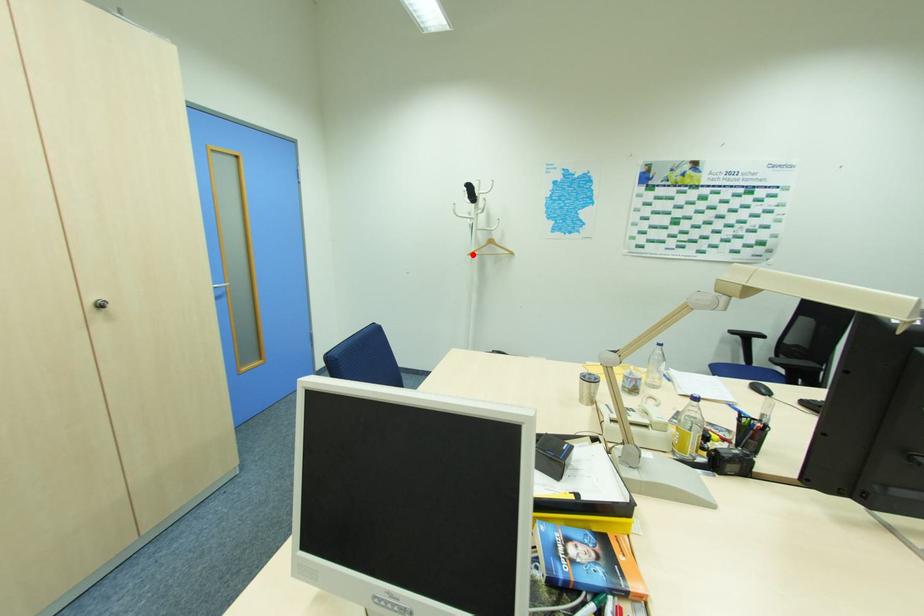
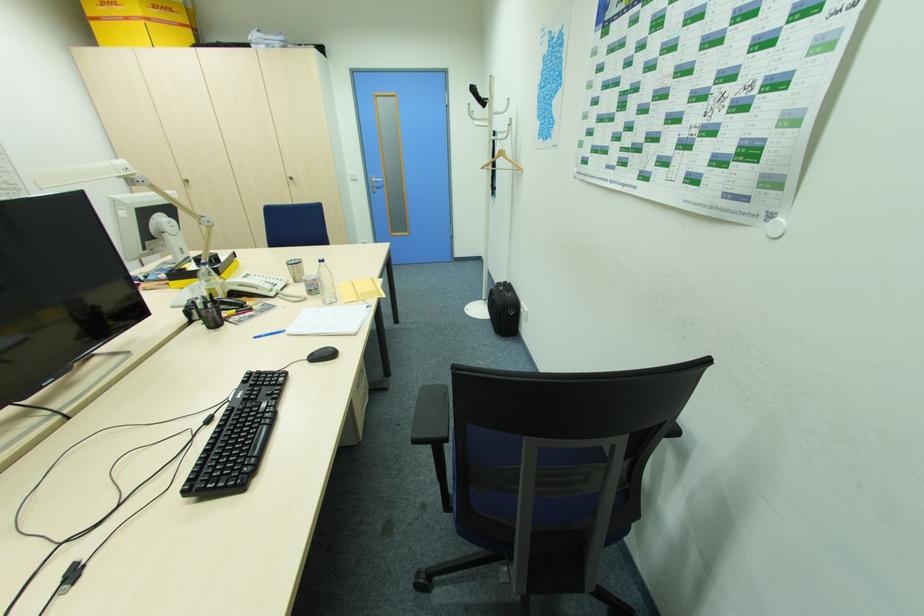
The point at the highlighted location is marked in the first image. Where is the corresponding point in the second image?

(485, 168)